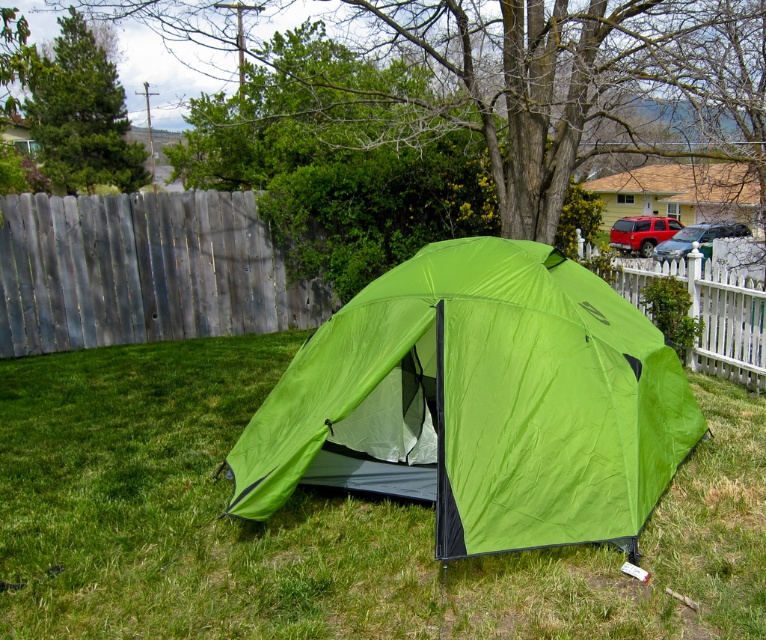
Question: Is lime green fabric tent at center positioned at the back of weathered wood fence at left?

Choices:
 (A) no
 (B) yes

Answer: (A)

Question: Which point is farther from the camera taking this photo?

Choices:
 (A) (280, 410)
 (B) (208, 243)
 (C) (378, 564)
 (D) (719, 346)

Answer: (B)

Question: Estimate the real-world distances between objects in this image. Which object is farther from the white picket fence at right?

Choices:
 (A) weathered wood fence at left
 (B) lime green fabric tent at center
 (C) green grass at center

Answer: (A)

Question: Is lime green fabric tent at center thinner than white picket fence at right?

Choices:
 (A) yes
 (B) no

Answer: (B)

Question: Which object is farther from the camera taking this photo?

Choices:
 (A) white picket fence at right
 (B) weathered wood fence at left

Answer: (B)

Question: Can you confirm if lime green fabric tent at center is positioned to the right of weathered wood fence at left?

Choices:
 (A) yes
 (B) no

Answer: (A)